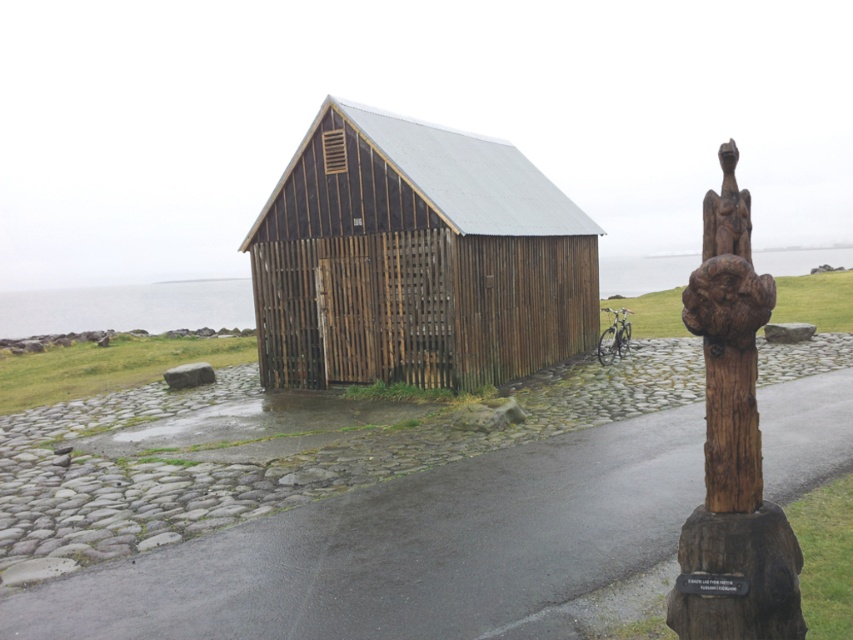
You are a visitor to this rustic area and want to take a photo of both the dark brown wooden barn at center and the carved wooden totem pole at right. Which object should you stand closer to in order to capture both in a single frame without moving the camera?

Since the dark brown wooden barn at center is much taller than the carved wooden totem pole at right, you should stand closer to the carved wooden totem pole at right to include both in the frame.

You are standing on the cobblestone pathway in front of the dark brown wooden barn at center. You want to look at the carved wooden totem pole at right. In which direction should you turn your head to see it?

You should turn your head to the right to see the carved wooden totem pole at right because it is positioned to the right of the cobblestone pathway leading up to the dark brown wooden barn at center.